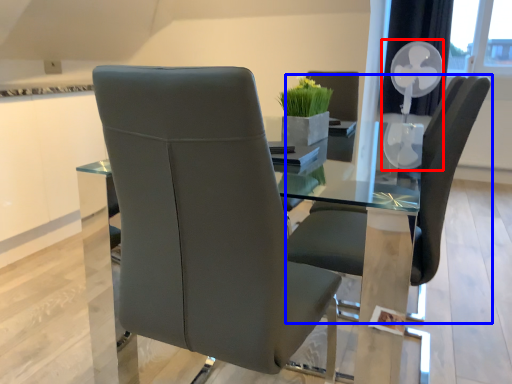
Question: Which point is further to the camera, fan (highlighted by a red box) or chair (highlighted by a blue box)?

Choices:
 (A) fan
 (B) chair

Answer: (A)